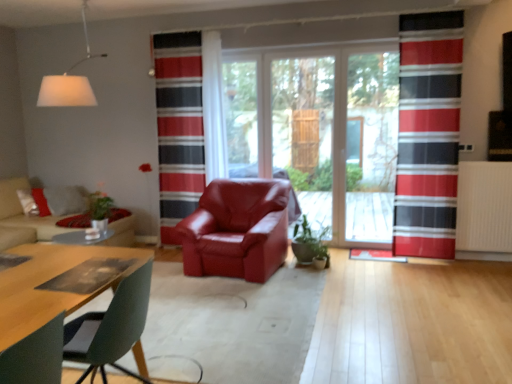
Question: Is white matte lampshade at upper left located outside green glossy plant at center?

Choices:
 (A) yes
 (B) no

Answer: (A)

Question: Is the position of white matte lampshade at upper left less distant than that of green glossy plant at center?

Choices:
 (A) yes
 (B) no

Answer: (A)

Question: Is white matte lampshade at upper left beside green glossy plant at center?

Choices:
 (A) yes
 (B) no

Answer: (B)

Question: Is white matte lampshade at upper left thinner than green glossy plant at center?

Choices:
 (A) yes
 (B) no

Answer: (B)

Question: From a real-world perspective, is white matte lampshade at upper left on top of green glossy plant at center?

Choices:
 (A) no
 (B) yes

Answer: (B)

Question: Is white matte lampshade at upper left further to camera compared to green glossy plant at center?

Choices:
 (A) yes
 (B) no

Answer: (B)

Question: Is red striped curtain at center, marked as the first curtain in a left-to-right arrangement, at the left side of green glossy plant at center?

Choices:
 (A) yes
 (B) no

Answer: (A)

Question: Can you confirm if red striped curtain at center, marked as the first curtain in a left-to-right arrangement, is shorter than green glossy plant at center?

Choices:
 (A) yes
 (B) no

Answer: (B)

Question: Is red striped curtain at center, the 2th curtain viewed from the front, aimed at green glossy plant at center?

Choices:
 (A) no
 (B) yes

Answer: (A)

Question: Is red striped curtain at center, marked as the first curtain in a left-to-right arrangement, surrounding green glossy plant at center?

Choices:
 (A) no
 (B) yes

Answer: (A)

Question: Is red striped curtain at center, the 2th curtain viewed from the front, taller than green glossy plant at center?

Choices:
 (A) no
 (B) yes

Answer: (B)

Question: From a real-world perspective, is red striped curtain at center, marked as the first curtain in a left-to-right arrangement, positioned under green glossy plant at center based on gravity?

Choices:
 (A) yes
 (B) no

Answer: (B)

Question: Considering the relative positions of white matte lampshade at upper left and transparent glass screen door at center, which is counted as the first screen door, starting from the right, in the image provided, is white matte lampshade at upper left to the right of transparent glass screen door at center, which is counted as the first screen door, starting from the right, from the viewer's perspective?

Choices:
 (A) no
 (B) yes

Answer: (A)